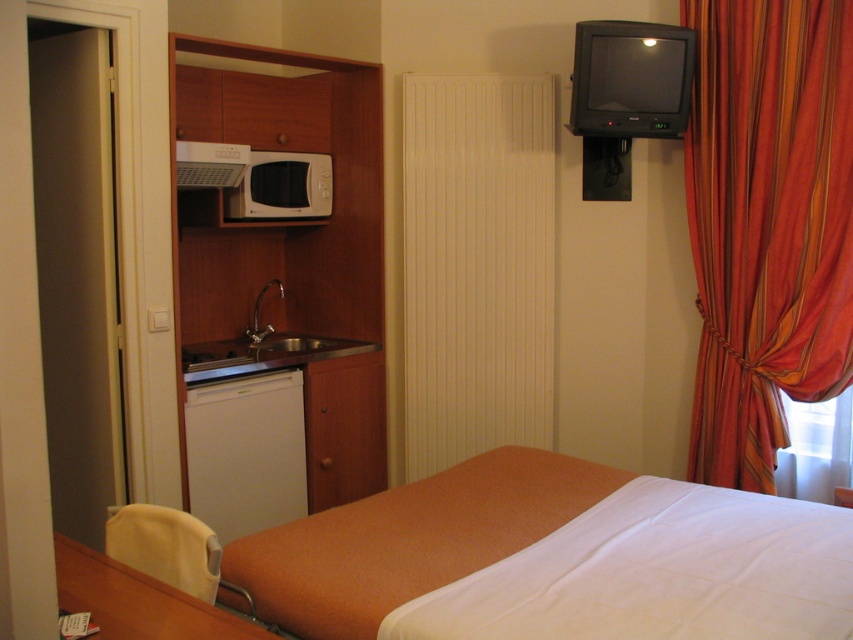
You are a guest in this hotel room and want to hang a picture frame on the wall behind the orange fabric bed at center and the orange striped fabric at right. Which object is closer to the ceiling so you know where to place the hook higher?

The orange striped fabric at right is taller than the orange fabric bed at center, so the hook should be placed higher near the orange striped fabric at right.

You are standing in the hotel room and want to place a small plant between the two points labeled point (404, 570) and point (822, 388). Which point should the plant be closer to in order to be nearer to the viewer?

The plant should be closer to point (404, 570) because it is nearer to the viewer compared to point (822, 388).